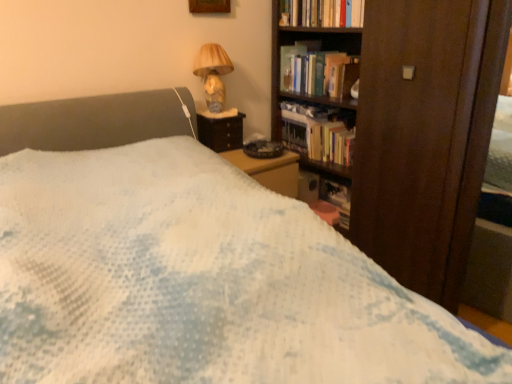
Question: Can you confirm if hardcover book at upper right is thinner than hardcover book at center, positioned as the 3th book in top-to-bottom order?

Choices:
 (A) yes
 (B) no

Answer: (A)

Question: From the image's perspective, is hardcover book at upper right below hardcover book at center, the 2th book positioned from the bottom?

Choices:
 (A) no
 (B) yes

Answer: (A)

Question: Does hardcover book at upper right have a lesser height compared to hardcover book at center, the 2th book positioned from the bottom?

Choices:
 (A) no
 (B) yes

Answer: (B)

Question: Is hardcover book at upper right taller than hardcover book at center, positioned as the 3th book in top-to-bottom order?

Choices:
 (A) yes
 (B) no

Answer: (B)

Question: Would you say hardcover book at upper right contains hardcover book at center, the 2th book positioned from the bottom?

Choices:
 (A) no
 (B) yes

Answer: (A)

Question: Looking at their shapes, would you say hardcover books at center, the 2th book positioned from the top, is wider or thinner than hardcover books at upper center, arranged as the fourth book when ordered from the bottom?

Choices:
 (A) wide
 (B) thin

Answer: (A)

Question: From a real-world perspective, is hardcover books at center, the 2th book positioned from the top, positioned above or below hardcover books at upper center, acting as the 1th book starting from the top?

Choices:
 (A) below
 (B) above

Answer: (A)

Question: Is hardcover books at center, which appears as the 3th book when ordered from the bottom, bigger or smaller than hardcover books at upper center, arranged as the fourth book when ordered from the bottom?

Choices:
 (A) big
 (B) small

Answer: (A)

Question: From the image's perspective, relative to hardcover books at upper center, acting as the 1th book starting from the top, is hardcover books at center, which appears as the 3th book when ordered from the bottom, above or below?

Choices:
 (A) below
 (B) above

Answer: (A)

Question: In the image, is hardcover books at center, the fourth book from the top, on the left side or the right side of hardcover book at upper right?

Choices:
 (A) right
 (B) left

Answer: (A)

Question: From a real-world perspective, relative to hardcover book at upper right, is hardcover books at center, placed as the first book when sorted from bottom to top, vertically above or below?

Choices:
 (A) below
 (B) above

Answer: (A)

Question: Looking at their shapes, would you say hardcover books at center, placed as the first book when sorted from bottom to top, is wider or thinner than hardcover book at upper right?

Choices:
 (A) wide
 (B) thin

Answer: (B)

Question: Is hardcover books at center, the fourth book from the top, in front of or behind hardcover book at upper right in the image?

Choices:
 (A) behind
 (B) front

Answer: (B)

Question: Is dark brown wooden bookcase at right bigger or smaller than hardcover books at upper center, arranged as the fourth book when ordered from the bottom?

Choices:
 (A) small
 (B) big

Answer: (B)

Question: Do you think dark brown wooden bookcase at right is within hardcover books at upper center, arranged as the fourth book when ordered from the bottom, or outside of it?

Choices:
 (A) inside
 (B) outside

Answer: (B)